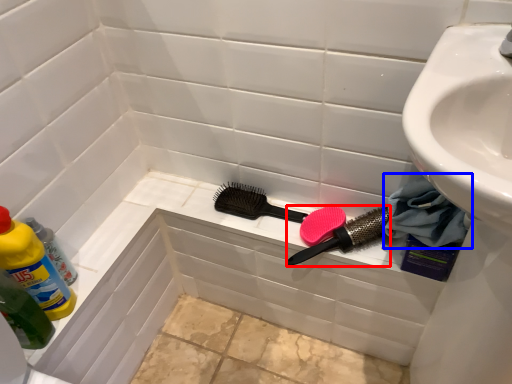
Question: Which point is further to the camera, brush (highlighted by a red box) or material (highlighted by a blue box)?

Choices:
 (A) brush
 (B) material

Answer: (A)